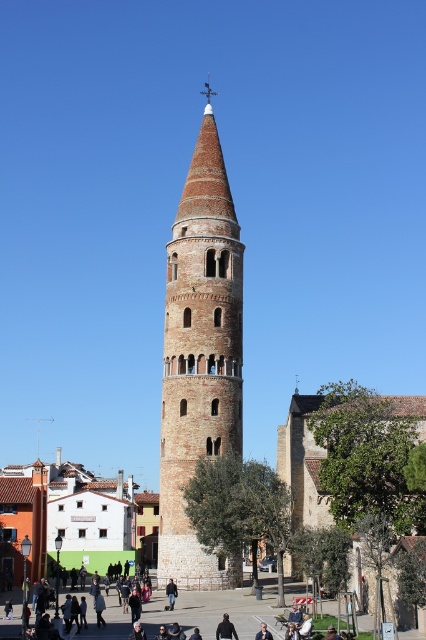
You are standing in the town square looking at the bell tower. You see a dark brown leather jacket at center. Where is the dark brown leather jacket located in relation to the bell tower?

The dark brown leather jacket at center is located at the center of the image, which is at point (215, 611) in 2D coordinates. Since the bell tower is the central structure in the town square, the jacket is likely positioned near the base of the bell tower.